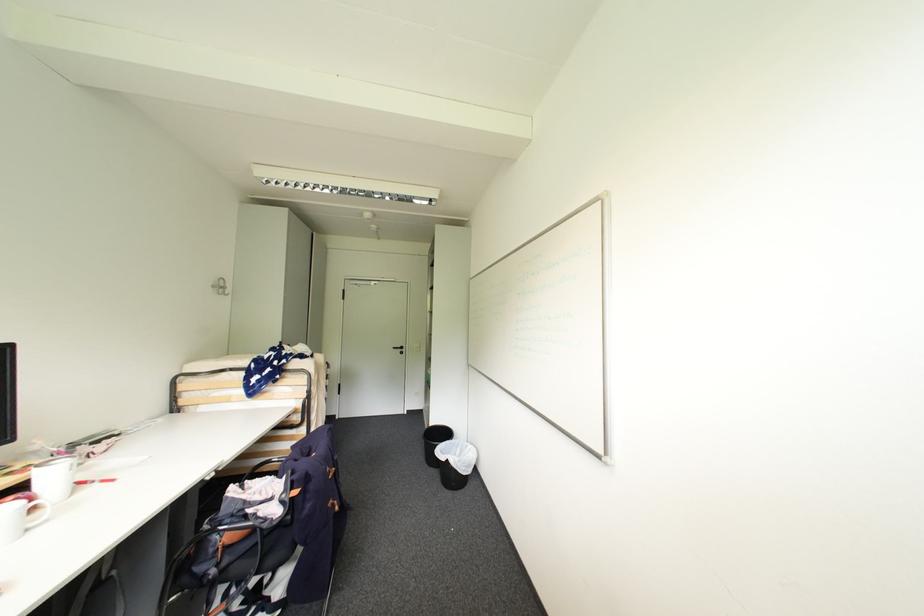
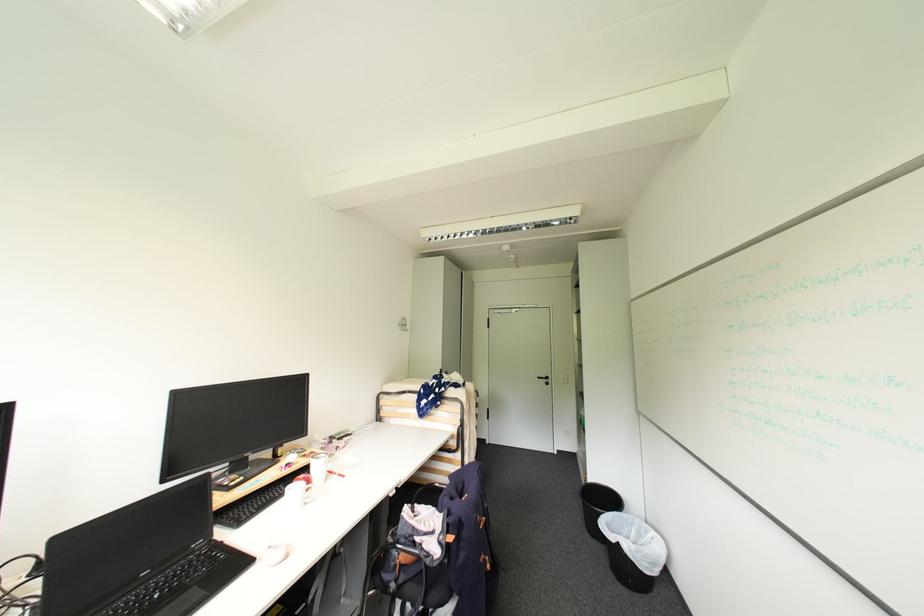
The point at (400, 349) is marked in the first image. Where is the corresponding point in the second image?

(544, 379)